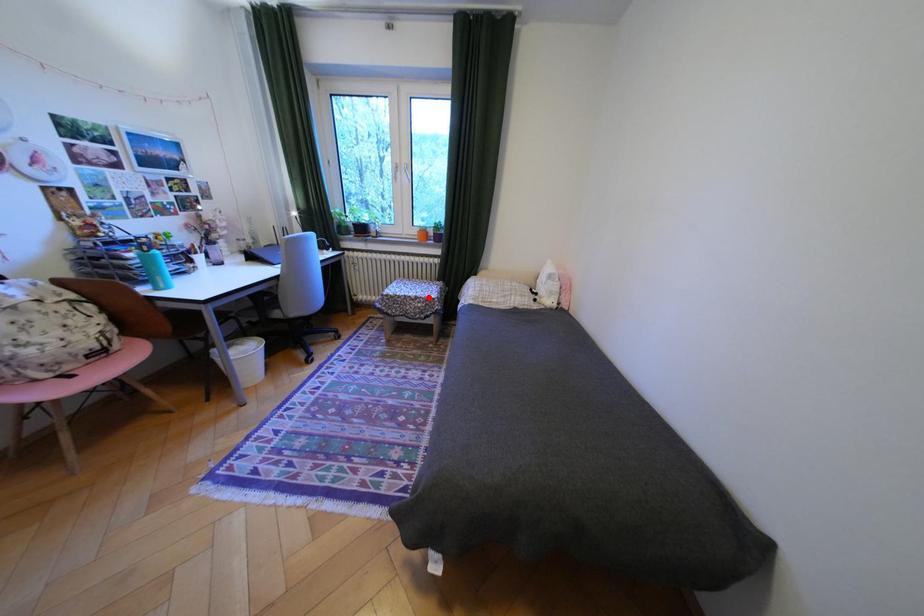
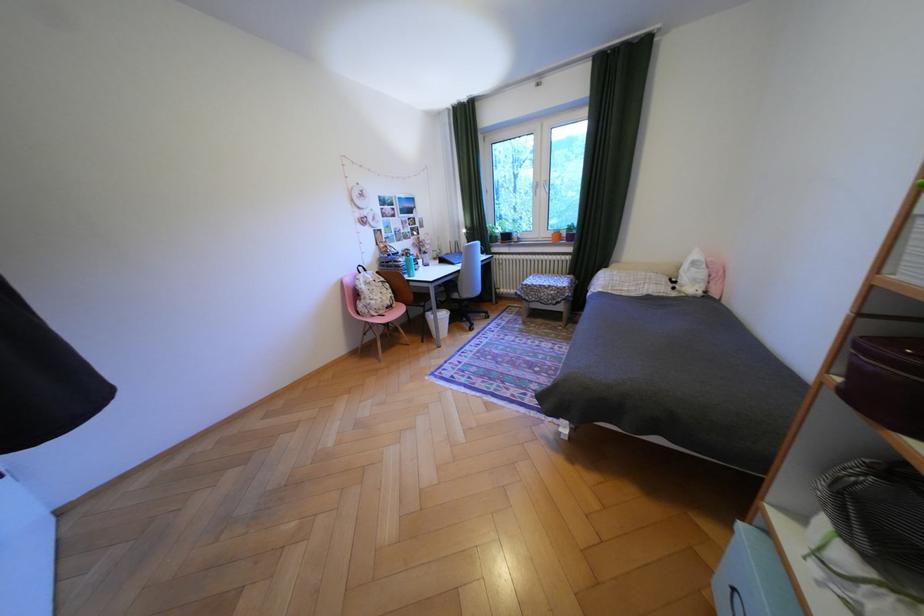
Locate, in the second image, the point that corresponds to the highlighted location in the first image.

(562, 286)